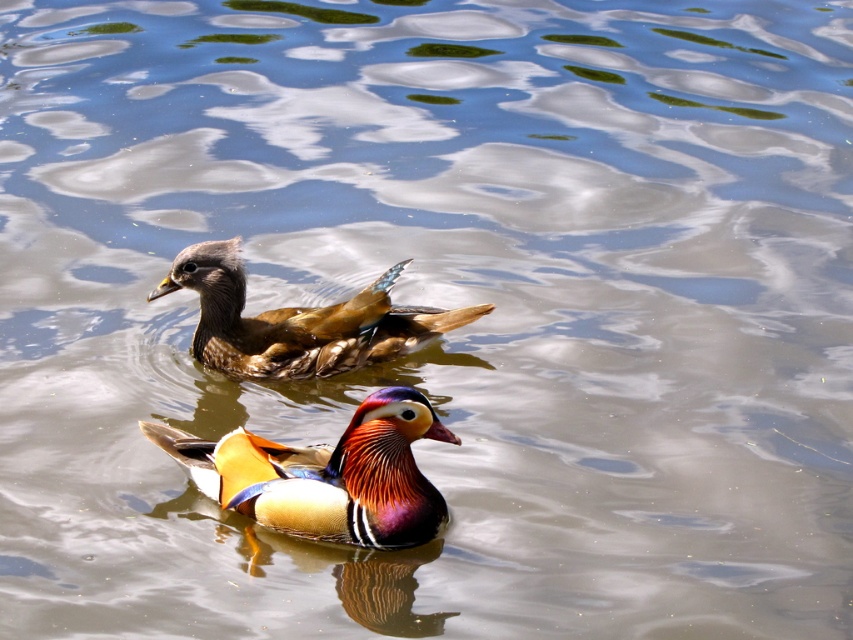
Looking at this image, you are a birdwatcher observing the ducks in the image. You notice the shiny multicolored duck at center and the brown matte duck at upper center. Which duck is located to the right of the other?

The shiny multicolored duck at center is positioned on the right side of brown matte duck at upper center.

You are a nature photographer trying to capture both ducks in a single shot. Given the scene, which duck, the shiny multicolored duck at center or the brown matte duck at upper center, will appear smaller in your photo?

The shiny multicolored duck at center will appear smaller in the photo because it has a lesser height compared to the brown matte duck at upper center.

You are standing at the edge of a pond and see a shiny multicolored duck at center. A point with coordinates (328, 474) is marked in the image. Can you determine whether this point is on the shiny multicolored duck at center?

The point (328, 474) is on the shiny multicolored duck at center, so yes, the point is on the shiny multicolored duck at center.